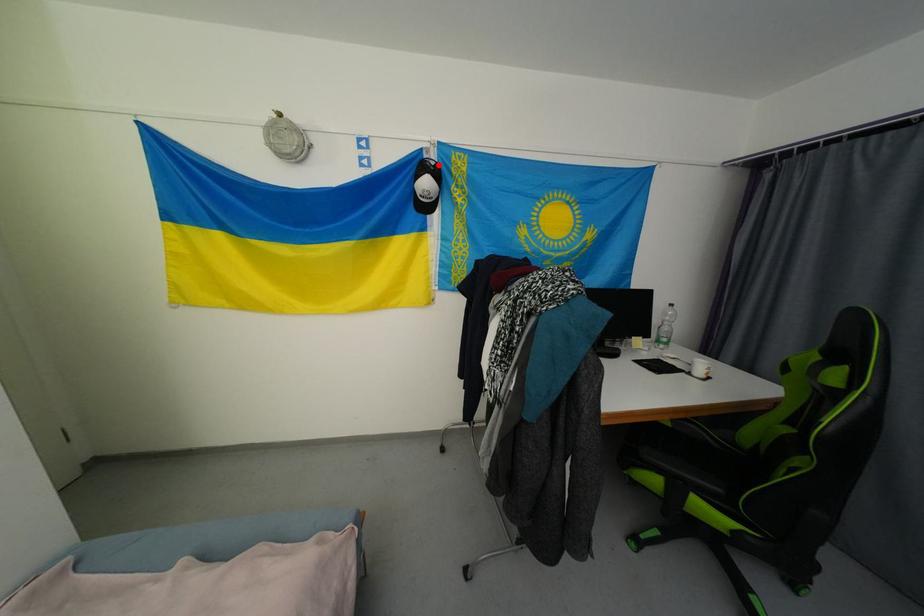
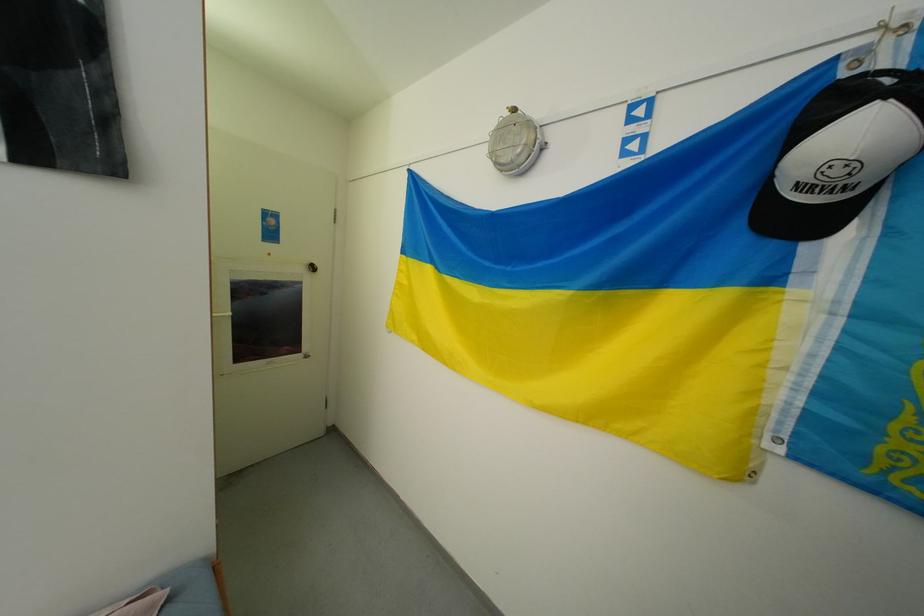
Locate, in the second image, the point that corresponds to the highlighted location in the first image.

(896, 81)